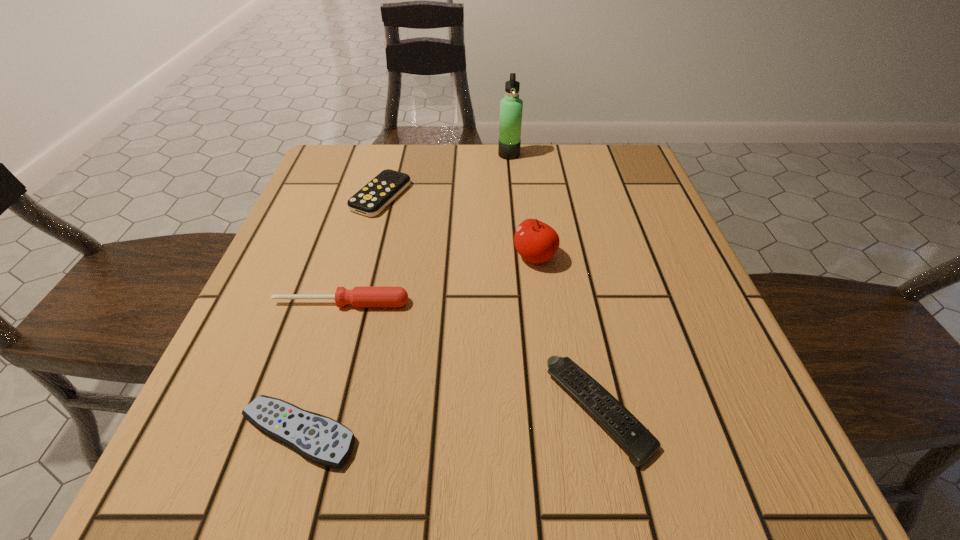
Where is `the tallest object`? The image size is (960, 540). the tallest object is located at coordinates point(511,106).

This screenshot has height=540, width=960. I want to click on the farthest object, so click(511, 106).

Find the location of `the fourth nearest object`. the fourth nearest object is located at coordinates (535, 241).

You are a GUI agent. You are given a task and a screenshot of the screen. Output one action in this format:
    pyautogui.click(x=<x>, y=<y>)
    Task: Click on the apple
    The width and height of the screenshot is (960, 540).
    Given the screenshot: What is the action you would take?
    pyautogui.click(x=535, y=241)

Where is `screwdriver`? The image size is (960, 540). screwdriver is located at coordinates (359, 296).

You are a GUI agent. You are given a task and a screenshot of the screen. Output one action in this format:
    pyautogui.click(x=<x>, y=<y>)
    Task: Click on the fourth shortest object
    The width and height of the screenshot is (960, 540).
    Given the screenshot: What is the action you would take?
    pyautogui.click(x=359, y=296)

At what (x,y) coordinates should I click in order to perform the action: click on the fifth nearest object. Please return your answer as a coordinate pair (x, y). This screenshot has height=540, width=960. Looking at the image, I should click on (376, 195).

Image resolution: width=960 pixels, height=540 pixels. What are the coordinates of `the rightmost remote control` in the screenshot? It's located at coord(636,440).

At what (x,y) coordinates should I click in order to perform the action: click on the shortest remote control. Please return your answer as a coordinate pair (x, y). The width and height of the screenshot is (960, 540). Looking at the image, I should click on (318, 438).

You are a GUI agent. You are given a task and a screenshot of the screen. Output one action in this format:
    pyautogui.click(x=<x>, y=<y>)
    Task: Click on the vacant space located on the right of the thermos bottle
    The height and width of the screenshot is (540, 960).
    Given the screenshot: What is the action you would take?
    pyautogui.click(x=612, y=154)